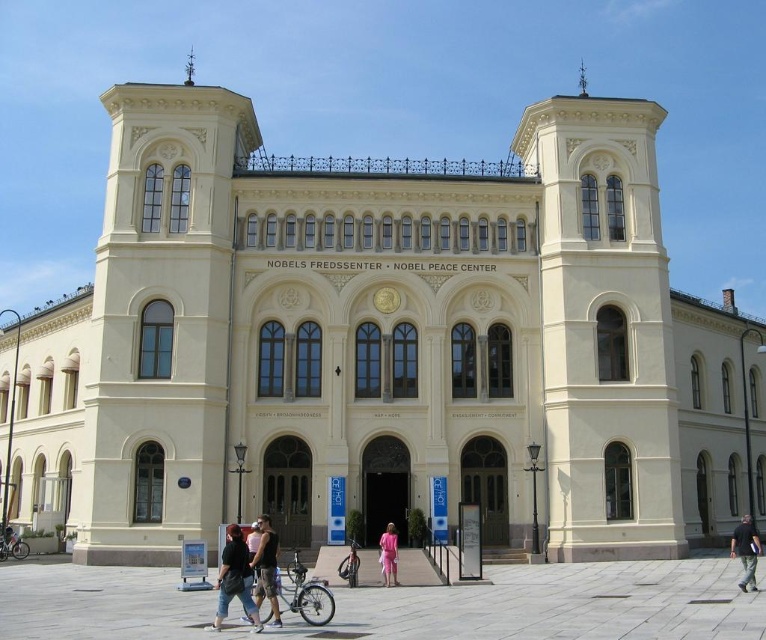
You are a tailor who needs to determine which clothing item takes up more horizontal space when laid flat. Based on the image, which item is wider between the dark brown leather jacket at center and the black cotton shirt at center?

The dark brown leather jacket at center has a lesser width compared to the black cotton shirt at center, so the black cotton shirt at center is wider.

You are a photographer standing in front of the Nobel Peace Center. You want to capture both the dark blue jeans at lower center and the dark brown leather jacket at center in a single photo. Which object will appear larger in the photo?

The dark blue jeans at lower center will appear larger in the photo because it is much taller than the dark brown leather jacket at center.

You are standing at the entrance of the Nobel Peace Center and want to take a photo of the dark blue jeans at lower center and the black cotton shirt at center. If your camera can focus on objects up to 100 feet away, will both items be in focus?

The dark blue jeans at lower center is 94.54 feet from the black cotton shirt at center. Since the camera can focus up to 100 feet, both items will be within the focus range and can be captured clearly.